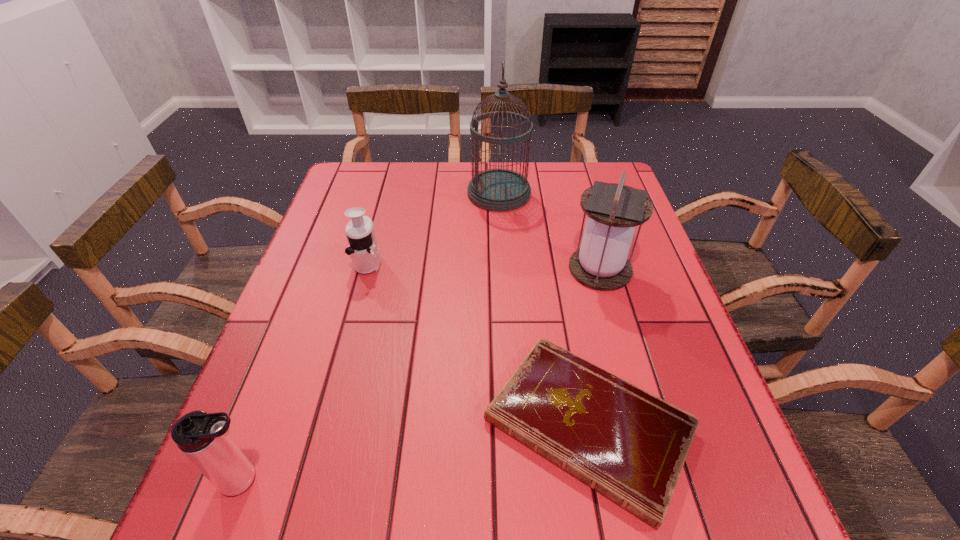
This screenshot has width=960, height=540. I want to click on the tallest object, so click(499, 190).

The height and width of the screenshot is (540, 960). Find the location of `birdcage`. birdcage is located at coordinates (499, 190).

The width and height of the screenshot is (960, 540). Identify the location of the fourth shortest object. (x=613, y=210).

Locate an element on the screen. The width and height of the screenshot is (960, 540). the leftmost object is located at coordinates (203, 438).

Locate an element on the screen. the second object from left to right is located at coordinates pos(363,249).

The height and width of the screenshot is (540, 960). I want to click on juicer, so click(363, 249).

Identify the location of notebook. The height and width of the screenshot is (540, 960). (627, 444).

The image size is (960, 540). Find the location of `free space located 0.280m on the front-facing side of the farthest object`. free space located 0.280m on the front-facing side of the farthest object is located at coordinates (375, 193).

Locate an element on the screen. The image size is (960, 540). vacant space located 0.150m on the front-facing side of the farthest object is located at coordinates (419, 193).

Image resolution: width=960 pixels, height=540 pixels. Find the location of `vacant space located 0.400m on the front-facing side of the farthest object`. vacant space located 0.400m on the front-facing side of the farthest object is located at coordinates (337, 193).